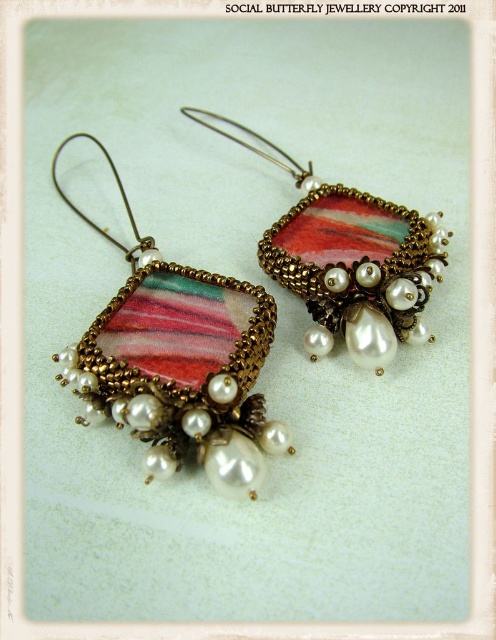
You are an earring designer looking at the image. You need to place a new silver chain between the matte pink fabric earring at left and the multicolored beaded pendant at center. Based on their current positions, where should you place the silver chain?

The silver chain should be placed between the matte pink fabric earring at left and the multicolored beaded pendant at center, as the matte pink fabric earring at left is positioned on the left side of multicolored beaded pendant at center.

You are a jewelry designer examining the earrings. You need to determine which object is taller between the matte pink fabric earring at left and the multicolored beaded pendant at center. Based on the scene, which one is taller?

The matte pink fabric earring at left is taller than the multicolored beaded pendant at center.